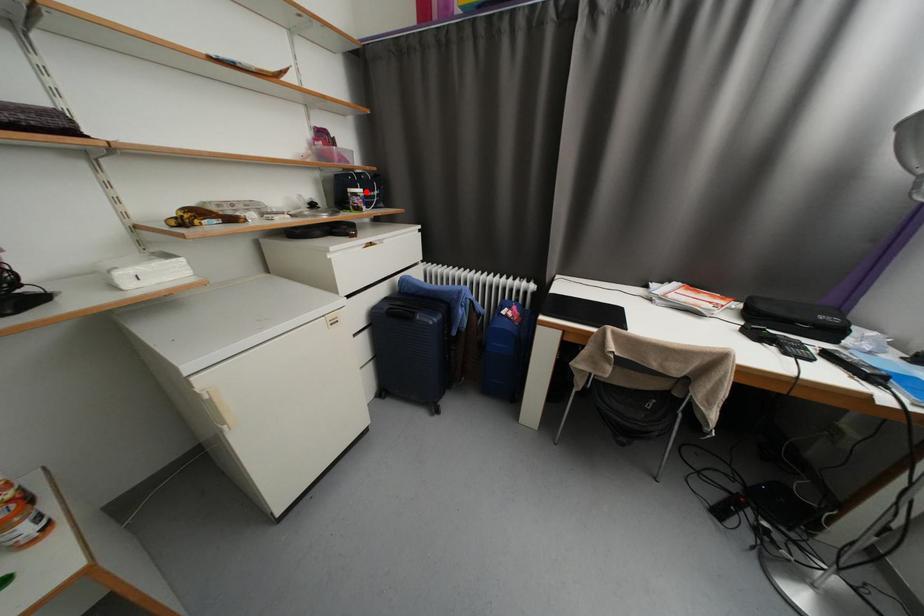
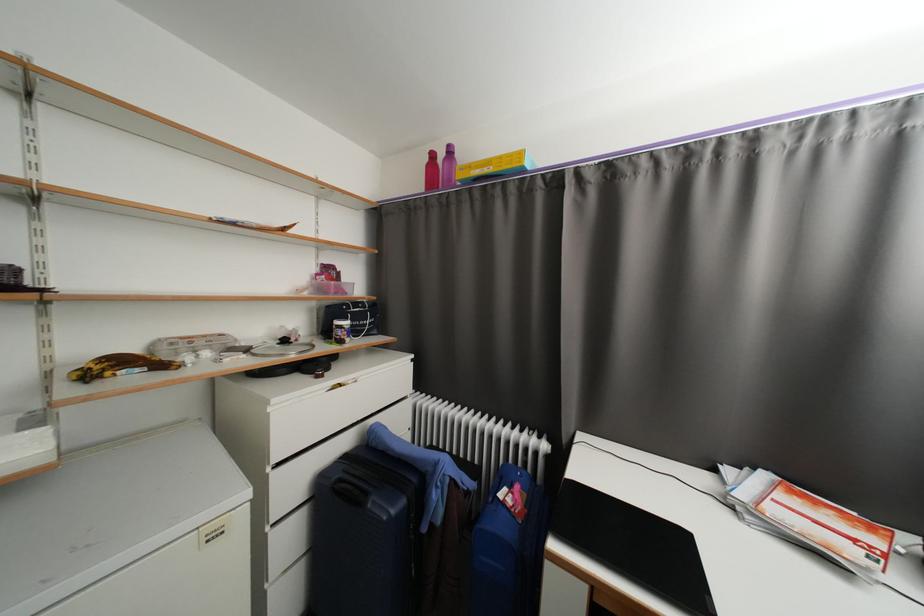
Question: I am providing you with two images of the same scene from different viewpoints. A red point is shown in image1. For the corresponding object point in image2, is it positioned nearer or farther from the camera?

Choices:
 (A) Nearer
 (B) Farther

Answer: (B)